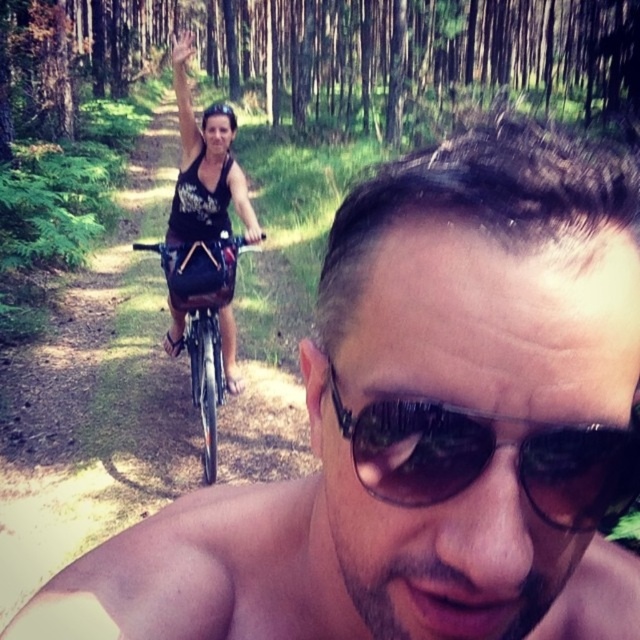
Is silver metallic bicycle at center bigger than black matte bicycle helmet at upper center?

Actually, silver metallic bicycle at center might be smaller than black matte bicycle helmet at upper center.

Is point (186, 273) in front of point (205, 112)?

Yes.

Where is `silver metallic bicycle at center`? The image size is (640, 640). silver metallic bicycle at center is located at coordinates (202, 321).

Does point (497, 32) lie behind point (164, 273)?

Yes, it is behind point (164, 273).

Does green leafy forest at upper center lie in front of silver metallic bicycle at center?

No.

Between point (588, 72) and point (205, 381), which one is positioned behind?

Point (588, 72)

Where is `green leafy forest at upper center`? green leafy forest at upper center is located at coordinates (324, 52).

Consider the image. Does black fabric tank top at upper left have a greater width compared to black matte bicycle helmet at upper center?

In fact, black fabric tank top at upper left might be narrower than black matte bicycle helmet at upper center.

Between point (172, 212) and point (234, 115), which one is positioned in front?

Positioned in front is point (172, 212).

You are a GUI agent. You are given a task and a screenshot of the screen. Output one action in this format:
    pyautogui.click(x=<x>, y=<y>)
    Task: Click on the black fabric tank top at upper left
    
    Given the screenshot: What is the action you would take?
    pyautogui.click(x=204, y=170)